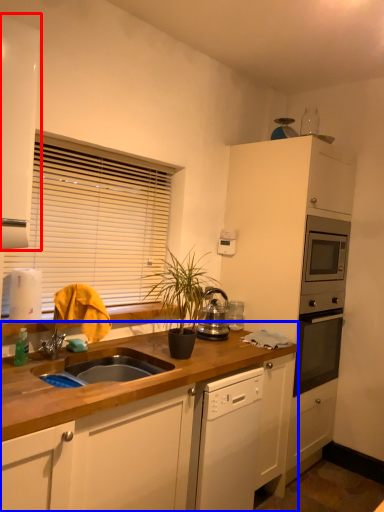
Question: Which object is further to the camera taking this photo, cabinetry (highlighted by a red box) or countertop (highlighted by a blue box)?

Choices:
 (A) cabinetry
 (B) countertop

Answer: (A)